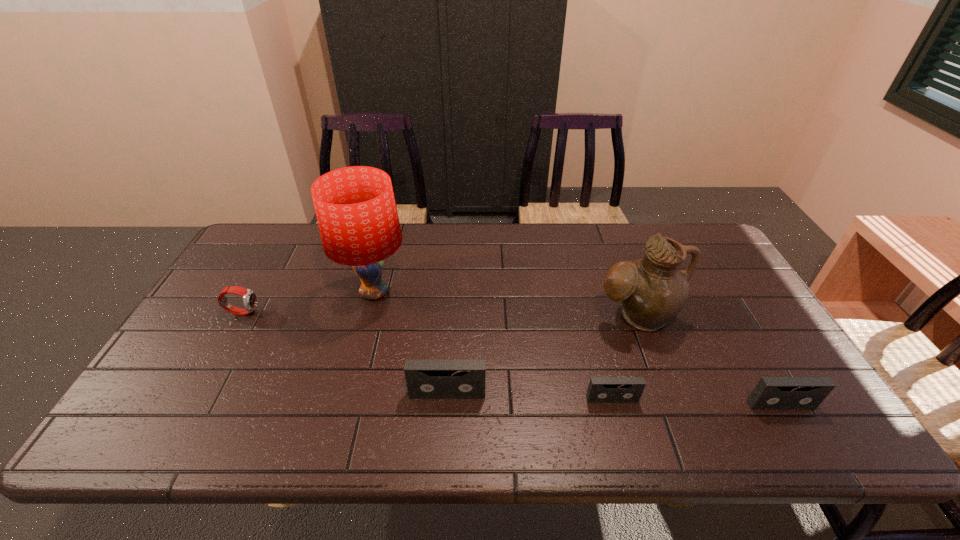
Image resolution: width=960 pixels, height=540 pixels. In the image, there is a desktop. What are the coordinates of `vacant space at the near left corner` in the screenshot? It's located at (202, 404).

Locate an element on the screen. vacant space at the far right corner of the desktop is located at coordinates (671, 235).

The height and width of the screenshot is (540, 960). I want to click on empty location between the watch and the fourth shortest object, so (x=345, y=353).

Identify the location of vacant area between the shortest object and the leftmost object. (427, 355).

You are a GUI agent. You are given a task and a screenshot of the screen. Output one action in this format:
    pyautogui.click(x=<x>, y=<y>)
    Task: Click on the free spot between the watch and the fourth object from right to left
    The width and height of the screenshot is (960, 540).
    Given the screenshot: What is the action you would take?
    pyautogui.click(x=345, y=353)

The height and width of the screenshot is (540, 960). Find the location of `empty location between the rightmost object and the fifth object from right to left`. empty location between the rightmost object and the fifth object from right to left is located at coordinates (577, 349).

Find the location of a particular element. The height and width of the screenshot is (540, 960). free space between the second videotape from right to left and the third tallest object is located at coordinates (530, 396).

Where is `vacant space in between the watch and the tallest object`? vacant space in between the watch and the tallest object is located at coordinates (308, 302).

Where is `vacant space that is in between the second shortest videotape and the tallest object`? vacant space that is in between the second shortest videotape and the tallest object is located at coordinates (577, 349).

Where is `unoccupied area between the watch and the third tallest object`? unoccupied area between the watch and the third tallest object is located at coordinates (345, 353).